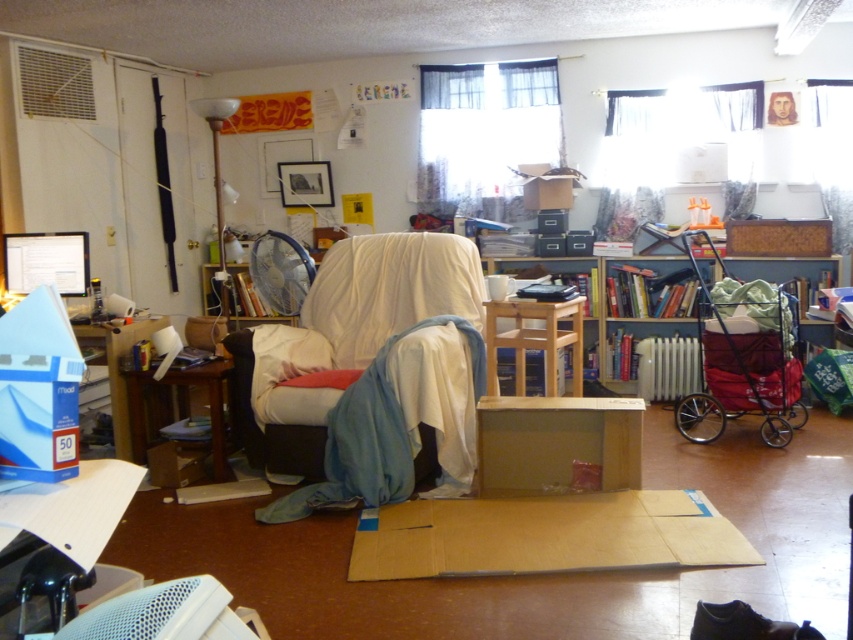
In the scene shown: You are moving a large painting that is 1.2 meters wide into this room. The painting needs to be placed between the white fabric chair at center and the wooden bookshelf at center. Will the space between them be wide enough to accommodate the painting?

The white fabric chair at center is narrower than the wooden bookshelf at center. However, the exact distance between them isn not specified in the provided description. Therefore, it is uncertain whether the space between them can accommodate the 1.2 meter wide painting based on the given information.

You are organizing a storage space and need to place both the brown cardboard box at center and the wooden bookshelf at center in the room. Given their sizes, which one can you fit into a smaller storage area?

The brown cardboard box at center can fit into a smaller storage area because it occupies less space than the wooden bookshelf at center.